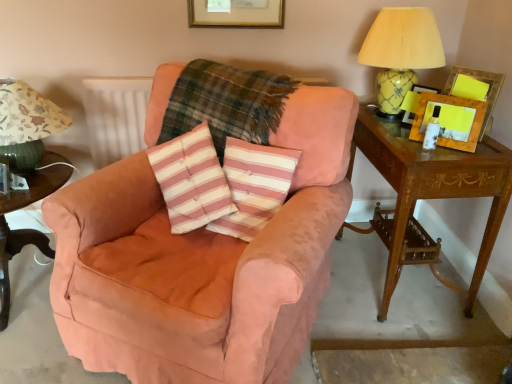
The height and width of the screenshot is (384, 512). I want to click on vacant space underneath dark green wood side table at lower left (from a real-world perspective), so click(x=29, y=279).